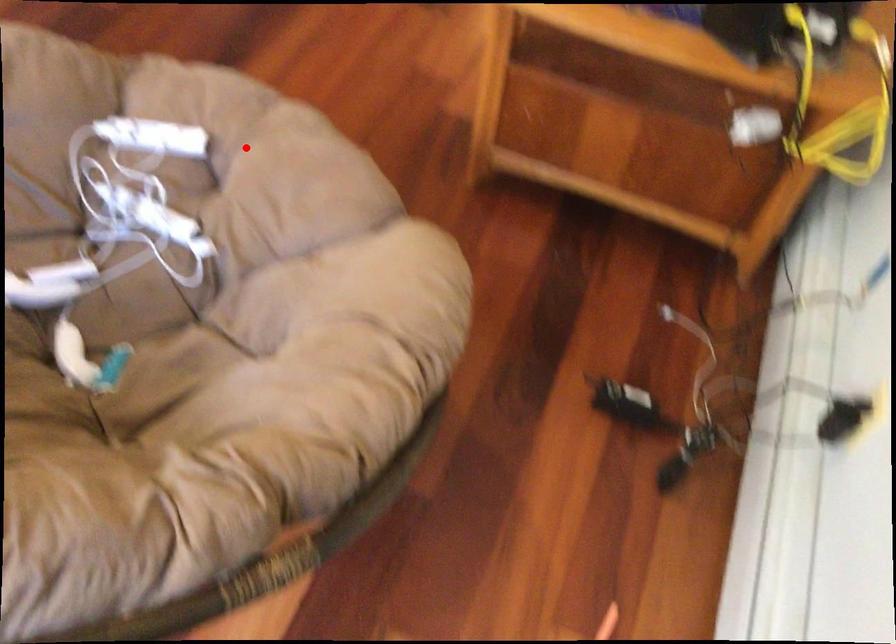
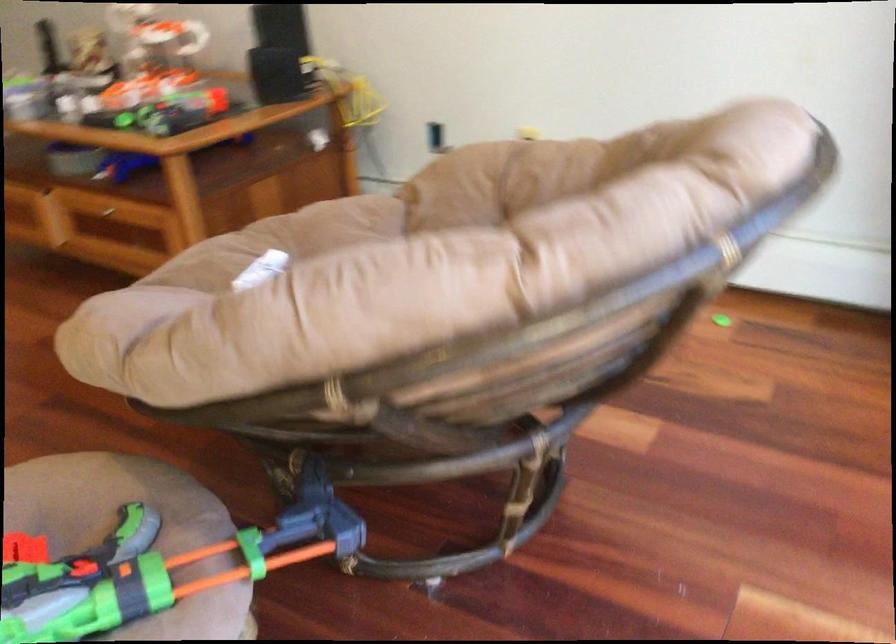
The point at the highlighted location is marked in the first image. Where is the corresponding point in the second image?

(281, 241)